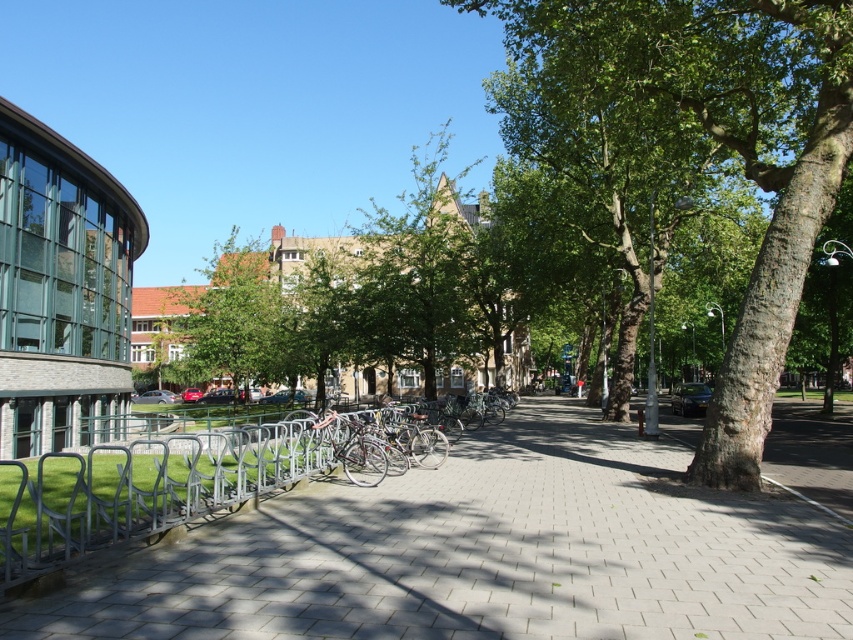
Question: Where is green rough bark tree at center located in relation to green leafy tree at center in the image?

Choices:
 (A) below
 (B) above

Answer: (B)

Question: Among these points, which one is farthest from the camera?

Choices:
 (A) (213, 429)
 (B) (308, 563)
 (C) (764, 29)

Answer: (A)

Question: From the image, what is the correct spatial relationship of green rough bark tree at center in relation to green leafy tree at center?

Choices:
 (A) right
 (B) left

Answer: (A)

Question: Is gray concrete pavement at center above green leafy tree at center?

Choices:
 (A) no
 (B) yes

Answer: (A)

Question: Which of the following is the closest to the observer?

Choices:
 (A) (389, 524)
 (B) (202, 301)
 (C) (688, 38)
 (D) (207, 433)

Answer: (A)

Question: Which object is farther from the camera taking this photo?

Choices:
 (A) gray concrete pavement at center
 (B) green rough bark tree at center
 (C) silver metallic bike rack at left

Answer: (B)